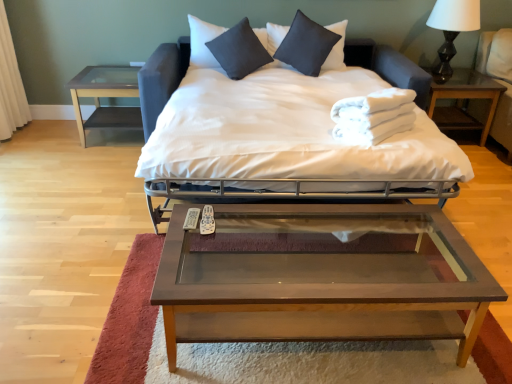
Question: Should I look upward or downward to see white fabric bed at center?

Choices:
 (A) down
 (B) up

Answer: (B)

Question: Can you confirm if white matte table lamp at upper right is positioned to the right of light brown wood armchair at right?

Choices:
 (A) no
 (B) yes

Answer: (A)

Question: From a real-world perspective, is white matte table lamp at upper right on top of light brown wood armchair at right?

Choices:
 (A) yes
 (B) no

Answer: (A)

Question: Are white matte table lamp at upper right and light brown wood armchair at right located far from each other?

Choices:
 (A) no
 (B) yes

Answer: (A)

Question: From the image's perspective, is white matte table lamp at upper right beneath light brown wood armchair at right?

Choices:
 (A) yes
 (B) no

Answer: (B)

Question: Considering the relative sizes of white matte table lamp at upper right and light brown wood armchair at right in the image provided, is white matte table lamp at upper right wider than light brown wood armchair at right?

Choices:
 (A) no
 (B) yes

Answer: (A)

Question: Would you say light brown wood armchair at right is part of white matte table lamp at upper right's contents?

Choices:
 (A) no
 (B) yes

Answer: (A)

Question: From the image's perspective, is white fabric towels at right, the first nightstand positioned from the right, below light brown wood armchair at right?

Choices:
 (A) yes
 (B) no

Answer: (A)

Question: Is white fabric towels at right, the first nightstand positioned from the right, bigger than light brown wood armchair at right?

Choices:
 (A) no
 (B) yes

Answer: (A)

Question: From a real-world perspective, does white fabric towels at right, the second nightstand positioned from the left, stand above light brown wood armchair at right?

Choices:
 (A) no
 (B) yes

Answer: (A)

Question: Is white fabric towels at right, the first nightstand positioned from the right, to the right of light brown wood armchair at right from the viewer's perspective?

Choices:
 (A) no
 (B) yes

Answer: (A)

Question: Does white fabric towels at right, the second nightstand positioned from the left, come behind light brown wood armchair at right?

Choices:
 (A) yes
 (B) no

Answer: (A)

Question: Considering the relative sizes of white fabric towels at right, the first nightstand positioned from the right, and light brown wood armchair at right in the image provided, is white fabric towels at right, the first nightstand positioned from the right, shorter than light brown wood armchair at right?

Choices:
 (A) no
 (B) yes

Answer: (B)

Question: Does clear glass table at left, which appears as the 2th nightstand when viewed from the right, appear on the right side of dark gray satin pillow at upper center, arranged as the second pillow when viewed from the left?

Choices:
 (A) no
 (B) yes

Answer: (A)